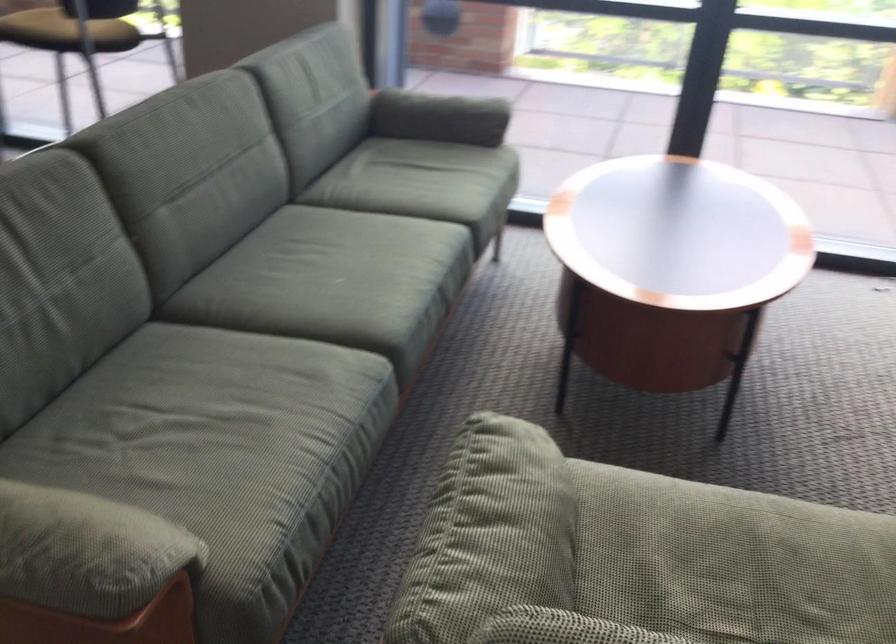
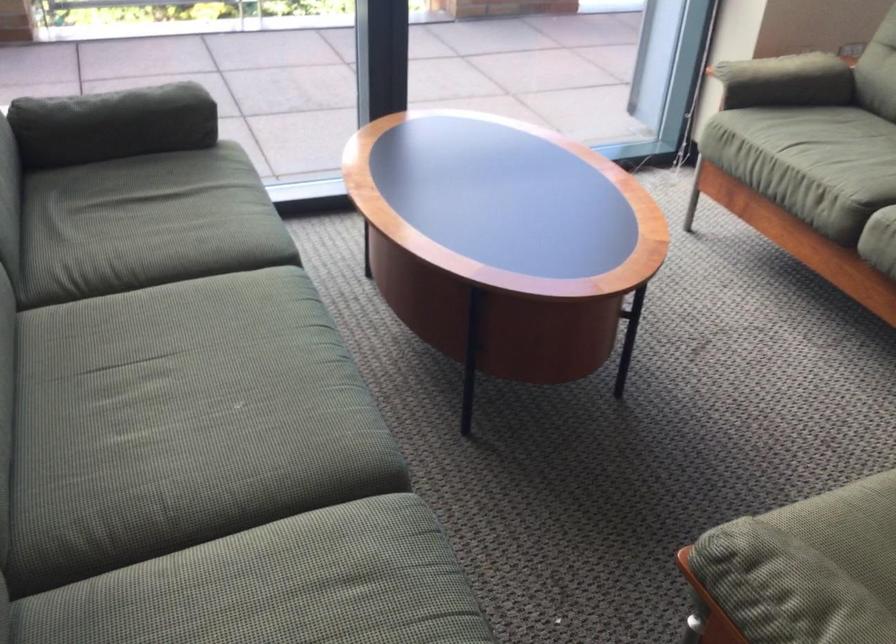
Where in the second image is the point corresponding to point 487,460 from the first image?

(785, 588)